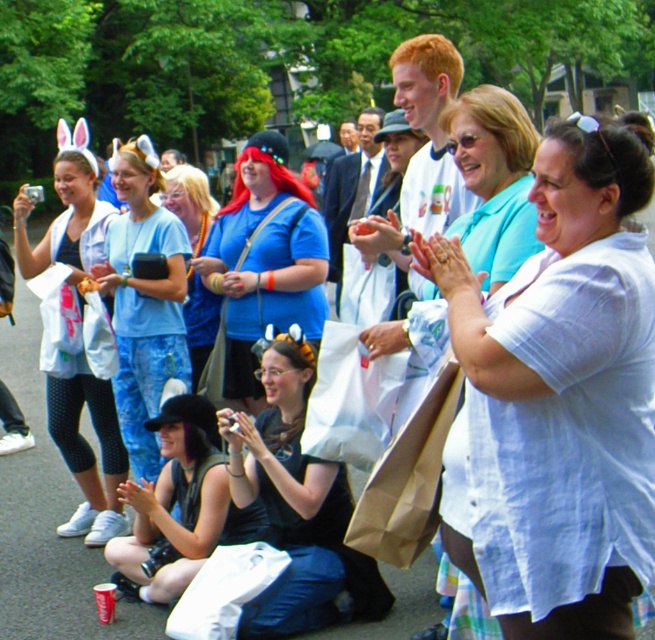
You are a photographer at the event and want to capture a clear shot of both the white cotton shirt at center and the matte white jacket at center. Which clothing item should you focus on first if you want to ensure it appears larger in the photo?

The white cotton shirt at center might be wider than matte white jacket at center, so focusing on the white cotton shirt at center first would ensure it appears larger in the photo.

You are attending an outdoor event and notice two white garments at the center of the scene. Which one is taller, the white cotton shirt at center or the matte white jacket at center?

The white cotton shirt at center is taller than the matte white jacket at center according to the description.